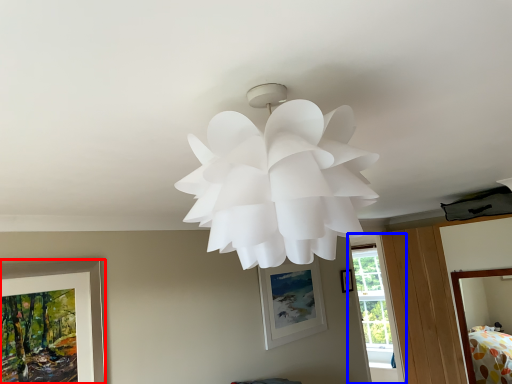
Question: Which object appears closest to the camera in this image, picture frame (highlighted by a red box) or window (highlighted by a blue box)?

Choices:
 (A) picture frame
 (B) window

Answer: (A)